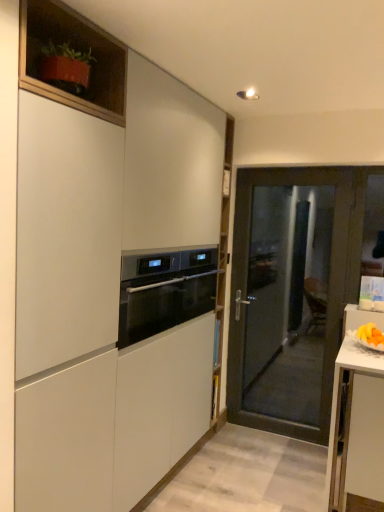
Question: Does black glass oven at center appear on the right side of matte white cabinet at center, acting as the 2th cabinetry starting from the back?

Choices:
 (A) no
 (B) yes

Answer: (B)

Question: From a real-world perspective, is black glass oven at center below matte white cabinet at center, which is the 1th cabinetry in front-to-back order?

Choices:
 (A) no
 (B) yes

Answer: (A)

Question: Is black glass oven at center positioned far away from matte white cabinet at center, which is the 1th cabinetry in front-to-back order?

Choices:
 (A) no
 (B) yes

Answer: (A)

Question: From the image's perspective, is black glass oven at center below matte white cabinet at center, the 1th cabinetry ordered from the bottom?

Choices:
 (A) yes
 (B) no

Answer: (B)

Question: Is black glass oven at center located outside matte white cabinet at center, the 1th cabinetry ordered from the bottom?

Choices:
 (A) yes
 (B) no

Answer: (B)

Question: Considering their positions, is transparent glass door at center located in front of or behind black glass oven at center?

Choices:
 (A) front
 (B) behind

Answer: (B)

Question: Visually, is transparent glass door at center positioned to the left or to the right of black glass oven at center?

Choices:
 (A) right
 (B) left

Answer: (A)

Question: In terms of width, does transparent glass door at center look wider or thinner when compared to black glass oven at center?

Choices:
 (A) wide
 (B) thin

Answer: (B)

Question: From the image's perspective, is transparent glass door at center located above or below black glass oven at center?

Choices:
 (A) above
 (B) below

Answer: (B)

Question: From the image's perspective, is matte wood cabinet at upper left, which appears as the first cabinetry when viewed from the top, positioned above or below transparent glass door at center?

Choices:
 (A) below
 (B) above

Answer: (B)

Question: Visually, is matte wood cabinet at upper left, the second cabinetry ordered from the bottom, positioned to the left or to the right of transparent glass door at center?

Choices:
 (A) right
 (B) left

Answer: (B)

Question: From a real-world perspective, is matte wood cabinet at upper left, which appears as the first cabinetry when viewed from the top, physically located above or below transparent glass door at center?

Choices:
 (A) above
 (B) below

Answer: (A)

Question: Do you think matte wood cabinet at upper left, which appears as the first cabinetry when viewed from the back, is within transparent glass door at center, or outside of it?

Choices:
 (A) outside
 (B) inside

Answer: (A)

Question: Do you think black glass oven at center is within matte wood cabinet at upper left, which appears as the first cabinetry when viewed from the back, or outside of it?

Choices:
 (A) inside
 (B) outside

Answer: (B)

Question: Is point (201, 287) positioned closer to the camera than point (84, 39)?

Choices:
 (A) closer
 (B) farther

Answer: (B)